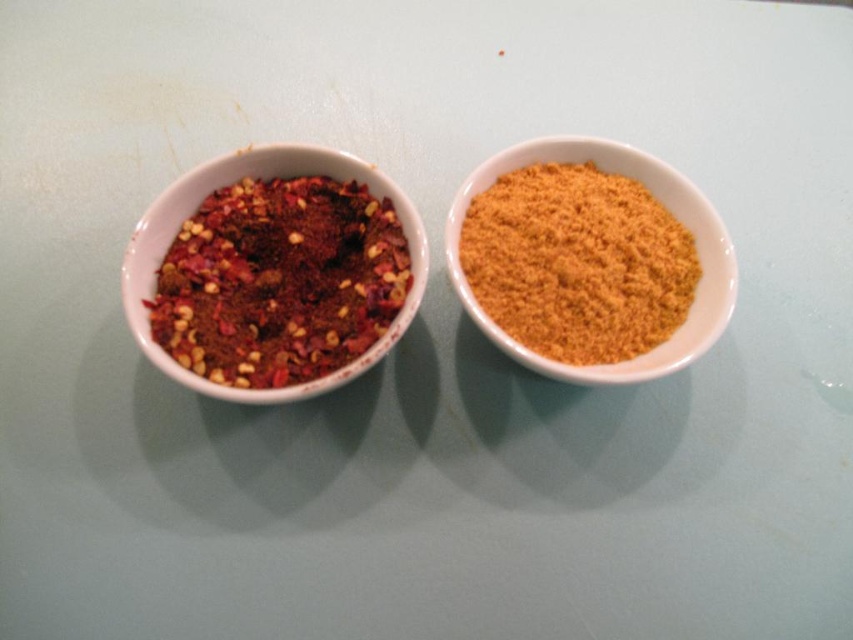
Question: Observing the image, what is the correct spatial positioning of crumbly red spice mix at left in reference to yellow powder at right?

Choices:
 (A) left
 (B) right

Answer: (A)

Question: Observing the image, what is the correct spatial positioning of crumbly red spice mix at left in reference to yellow powder at right?

Choices:
 (A) below
 (B) above

Answer: (A)

Question: Which point is closer to the camera taking this photo?

Choices:
 (A) (199, 220)
 (B) (474, 212)

Answer: (A)

Question: Can you confirm if crumbly red spice mix at left is positioned below yellow powder at right?

Choices:
 (A) no
 (B) yes

Answer: (B)